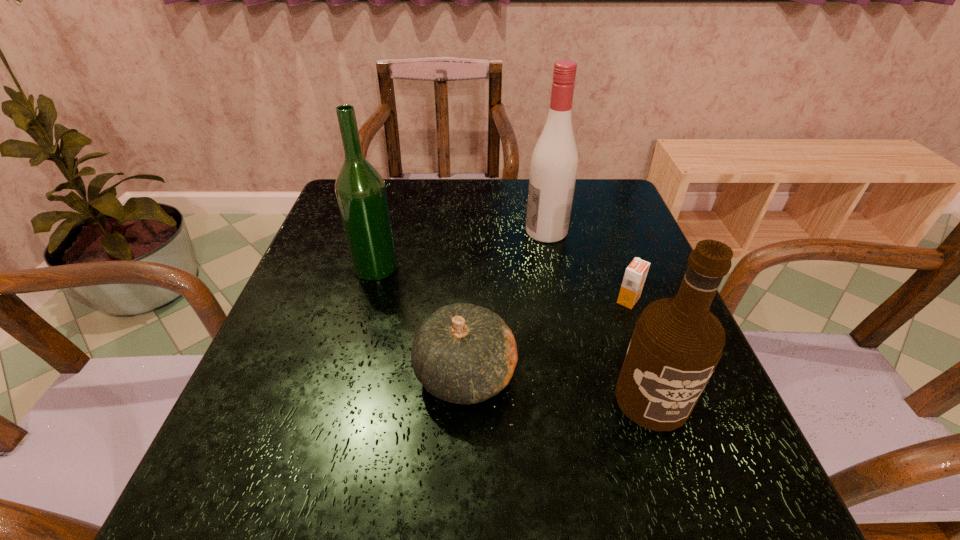
Find the location of a particular element. This screenshot has width=960, height=540. vacant space that satisfies the following two spatial constraints: 1. on the label of the orange juice; 2. on the right side of the third object from left to right is located at coordinates (560, 300).